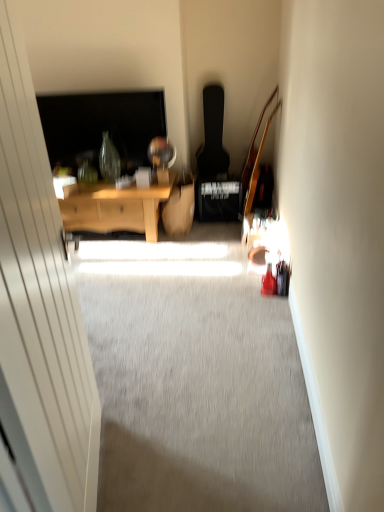
Describe the element at coordinates (40, 308) in the screenshot. The width and height of the screenshot is (384, 512). I see `transparent glass door at left` at that location.

I want to click on transparent glass door at left, so click(x=40, y=308).

Describe the element at coordinates (114, 208) in the screenshot. I see `wooden desk at center` at that location.

Locate an element on the screen. This screenshot has width=384, height=512. wooden desk at center is located at coordinates (114, 208).

At what (x,y) coordinates should I click in order to perform the action: click on transparent glass door at left. Please return your answer as a coordinate pair (x, y). Image resolution: width=384 pixels, height=512 pixels. Looking at the image, I should click on (40, 308).

Between wooden desk at center and transparent glass door at left, which one appears on the right side from the viewer's perspective?

Positioned to the right is transparent glass door at left.

Who is more distant, wooden desk at center or transparent glass door at left?

wooden desk at center.

Between point (165, 191) and point (95, 500), which one is positioned in front?

Point (95, 500)

Based on the photo, from the image's perspective, relative to transparent glass door at left, is wooden desk at center above or below?

Based on their image positions, wooden desk at center is located above transparent glass door at left.

From a real-world perspective, which is physically below, wooden desk at center or transparent glass door at left?

In real-world perspective, wooden desk at center is lower.

Considering the relative sizes of wooden desk at center and transparent glass door at left in the image provided, is wooden desk at center thinner than transparent glass door at left?

Incorrect, the width of wooden desk at center is not less than that of transparent glass door at left.

Considering the sizes of wooden desk at center and transparent glass door at left in the image, is wooden desk at center taller or shorter than transparent glass door at left?

Clearly, wooden desk at center is shorter compared to transparent glass door at left.

Is wooden desk at center smaller than transparent glass door at left?

No.

Is wooden desk at center inside the boundaries of transparent glass door at left, or outside?

The correct answer is: outside.

Are wooden desk at center and transparent glass door at left far apart?

wooden desk at center is positioned a significant distance from transparent glass door at left.

Is wooden desk at center positioned with its back to transparent glass door at left?

No.

How many degrees apart are the facing directions of wooden desk at center and transparent glass door at left?

The facing directions of wooden desk at center and transparent glass door at left are 102 degrees apart.

Locate an element on the screen. The height and width of the screenshot is (512, 384). desk above the transparent glass door at left (from the image's perspective) is located at coordinates (114, 208).

Considering the positions of objects transparent glass door at left and wooden desk at center in the image provided, who is more to the right, transparent glass door at left or wooden desk at center?

From the viewer's perspective, transparent glass door at left appears more on the right side.

Which object is more forward, transparent glass door at left or wooden desk at center?

transparent glass door at left is in front.

Does point (81, 459) come in front of point (90, 231)?

Yes, point (81, 459) is closer to viewer.

From the image's perspective, is transparent glass door at left positioned above or below wooden desk at center?

Clearly, from the image's perspective, transparent glass door at left is below wooden desk at center.

From a real-world perspective, between transparent glass door at left and wooden desk at center, who is vertically lower?

In real-world perspective, wooden desk at center is lower.

Does transparent glass door at left have a greater width compared to wooden desk at center?

In fact, transparent glass door at left might be narrower than wooden desk at center.

Considering the sizes of transparent glass door at left and wooden desk at center in the image, is transparent glass door at left taller or shorter than wooden desk at center?

Considering their sizes, transparent glass door at left has more height than wooden desk at center.

Does transparent glass door at left have a smaller size compared to wooden desk at center?

Yes, transparent glass door at left is smaller than wooden desk at center.

Does transparent glass door at left contain wooden desk at center?

That's incorrect, wooden desk at center is not inside transparent glass door at left.

Can you see transparent glass door at left touching wooden desk at center?

No, transparent glass door at left is not with wooden desk at center.

Is transparent glass door at left facing away from wooden desk at center?

transparent glass door at left is not turned away from wooden desk at center.

Find the location of `glass door lying below the wooden desk at center (from the image's perspective)`. glass door lying below the wooden desk at center (from the image's perspective) is located at coordinates (40, 308).

Locate an element on the screen. desk located on the left of transparent glass door at left is located at coordinates (114, 208).

This screenshot has width=384, height=512. What are the coordinates of `glass door located in front of the wooden desk at center` in the screenshot? It's located at (40, 308).